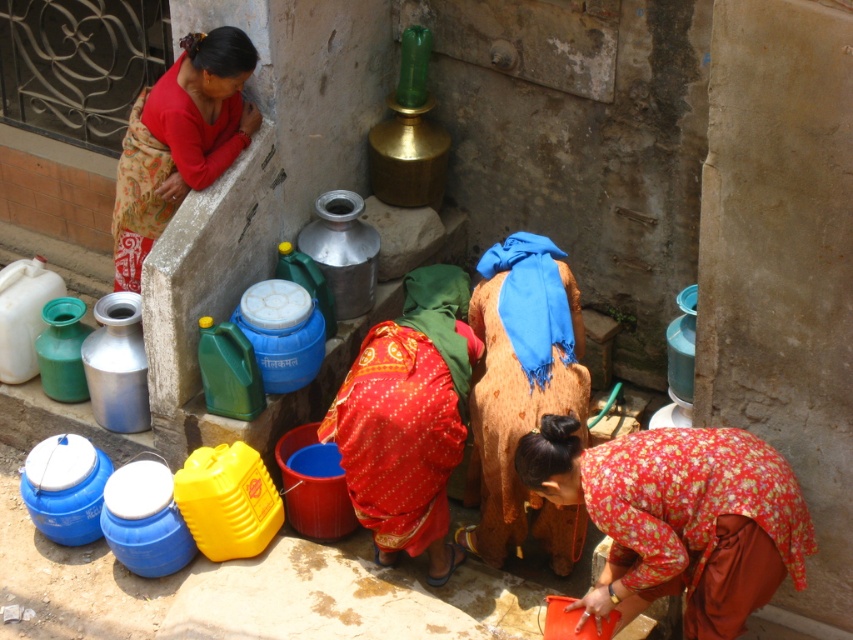
At what (x,y) coordinates should I click in order to perform the action: click on floral fabric dress at lower center. Please return your answer as a coordinate pair (x, y). Looking at the image, I should click on (677, 516).

Describe the element at coordinates (677, 516) in the screenshot. I see `floral fabric dress at lower center` at that location.

Identify the location of floral fabric dress at lower center. (677, 516).

Does red floral dress at center appear over matte red fabric at upper left?

Actually, red floral dress at center is below matte red fabric at upper left.

Who is positioned more to the left, red floral dress at center or matte red fabric at upper left?

Positioned to the left is matte red fabric at upper left.

Measure the distance between red floral dress at center and camera.

They are 16.95 feet apart.

Where is `red floral dress at center`? This screenshot has height=640, width=853. red floral dress at center is located at coordinates (408, 419).

Can you confirm if floral fabric dress at lower center is positioned above red floral dress at center?

No.

Is floral fabric dress at lower center wider than red floral dress at center?

Correct, the width of floral fabric dress at lower center exceeds that of red floral dress at center.

Identify the location of floral fabric dress at lower center. (677, 516).

The height and width of the screenshot is (640, 853). Identify the location of floral fabric dress at lower center. (677, 516).